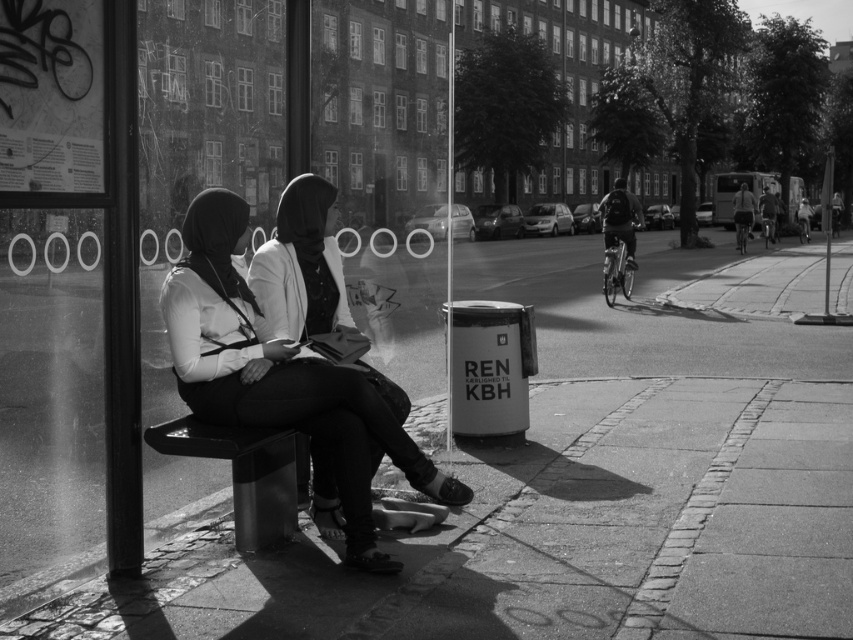
You are a photographer adjusting your camera to focus on two points in the image. The first point is at coordinate point (631, 200) and the second is at coordinate point (769, 218). Which point should you focus on first if you want to capture the closest object to the camera?

Point (631, 200) is closer to the camera than point (769, 218), so you should focus on point (631, 200) first to capture the closest object.

You are a tailor observing two jackets in a black and white photo. The scene shows two people sitting on a bench at a bus stop. You need to determine which jacket is taller. The jackets are the dark fabric jacket at right and the dark gray fabric jacket at center right. Which one is taller?

The dark fabric jacket at right is taller than the dark gray fabric jacket at center right.

You are a photographer standing in front of the bus stop scene. You want to take a photo that includes both the light brown leather jacket at right and the dark gray fabric jacket at center right. Which jacket will appear larger in your photo?

The light brown leather jacket at right will appear larger in the photo because it is closer to the viewer than the dark gray fabric jacket at center right.